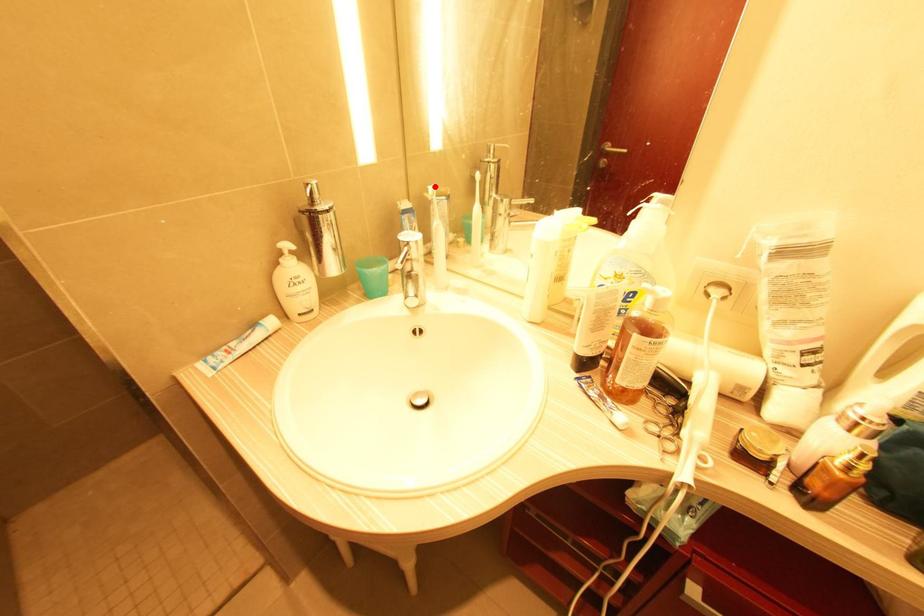
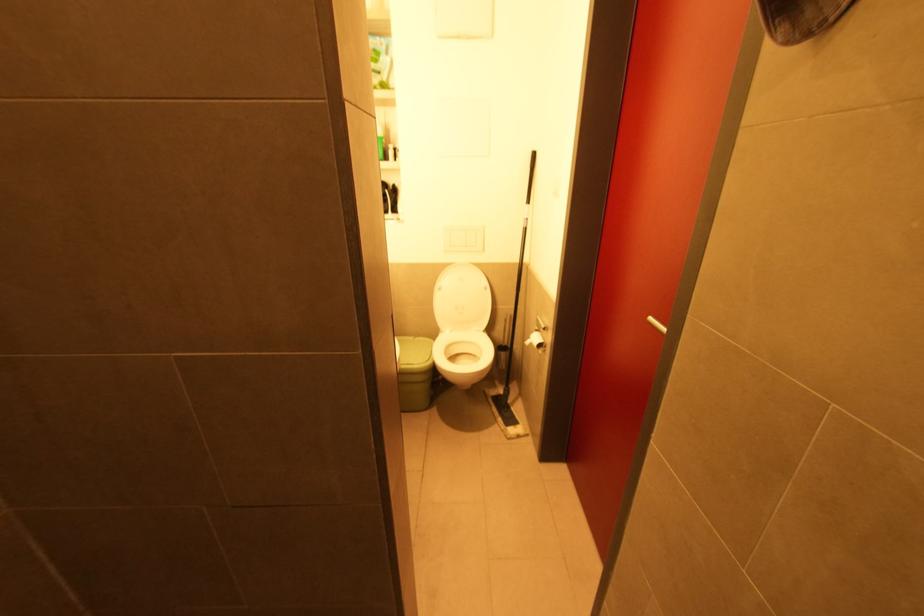
Question: I am providing you with two images of the same scene from different viewpoints. A red point is marked on the first image. Can you still see the location of the red point in image 2?

Choices:
 (A) Yes
 (B) No

Answer: (B)